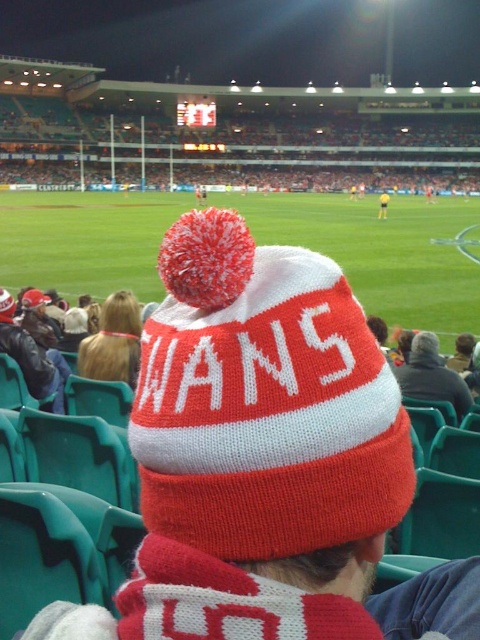
Can you confirm if green grass football field at center is positioned above blonde hair at center?

Yes, green grass football field at center is above blonde hair at center.

Does green grass football field at center have a lesser height compared to blonde hair at center?

No.

Does point (300, 218) come in front of point (105, 321)?

That is False.

This screenshot has width=480, height=640. I want to click on green grass football field at center, so click(381, 252).

Between blonde hair at center and dark gray sweater at center, which one appears on the left side from the viewer's perspective?

From the viewer's perspective, blonde hair at center appears more on the left side.

Which of these two, blonde hair at center or dark gray sweater at center, stands taller?

blonde hair at center

Image resolution: width=480 pixels, height=640 pixels. Find the location of `blonde hair at center`. blonde hair at center is located at coordinates (113, 340).

Can you confirm if knitted woolen hat at center is smaller than yellow jersey at center?

Indeed, knitted woolen hat at center has a smaller size compared to yellow jersey at center.

Can you confirm if knitted woolen hat at center is taller than yellow jersey at center?

Incorrect, knitted woolen hat at center's height is not larger of yellow jersey at center's.

Between point (275, 422) and point (382, 212), which one is positioned in front?

Point (275, 422)

I want to click on knitted woolen hat at center, so click(265, 460).